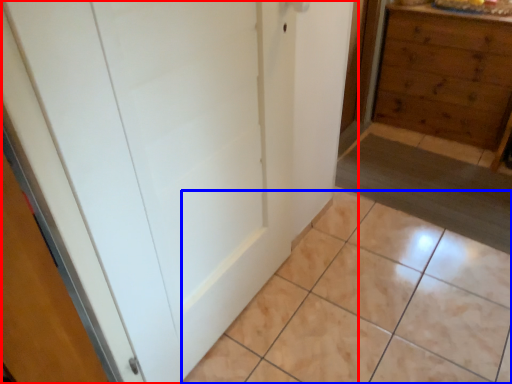
Question: Which object is closer to the camera taking this photo, door (highlighted by a red box) or ceramic tile (highlighted by a blue box)?

Choices:
 (A) door
 (B) ceramic tile

Answer: (A)